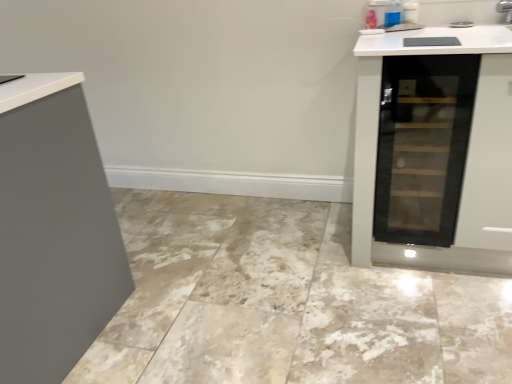
Question: Considering the relative sizes of transparent glass wine cooler at right and marble tile at center in the image provided, is transparent glass wine cooler at right thinner than marble tile at center?

Choices:
 (A) no
 (B) yes

Answer: (B)

Question: Is transparent glass wine cooler at right not inside marble tile at center?

Choices:
 (A) yes
 (B) no

Answer: (A)

Question: Can you confirm if transparent glass wine cooler at right is taller than marble tile at center?

Choices:
 (A) yes
 (B) no

Answer: (A)

Question: Is transparent glass wine cooler at right oriented towards marble tile at center?

Choices:
 (A) no
 (B) yes

Answer: (A)

Question: Is transparent glass wine cooler at right surrounding marble tile at center?

Choices:
 (A) yes
 (B) no

Answer: (B)

Question: Is transparent glass wine cooler at right to the right of marble tile at center from the viewer's perspective?

Choices:
 (A) no
 (B) yes

Answer: (B)

Question: Is marble tile at center wider than transparent glass wine cooler at right?

Choices:
 (A) yes
 (B) no

Answer: (A)

Question: Is marble tile at center thinner than transparent glass wine cooler at right?

Choices:
 (A) no
 (B) yes

Answer: (A)

Question: Is marble tile at center at the left side of transparent glass wine cooler at right?

Choices:
 (A) no
 (B) yes

Answer: (B)

Question: Does marble tile at center come in front of transparent glass wine cooler at right?

Choices:
 (A) no
 (B) yes

Answer: (B)

Question: Can you confirm if marble tile at center is bigger than transparent glass wine cooler at right?

Choices:
 (A) no
 (B) yes

Answer: (B)

Question: From the image's perspective, does marble tile at center appear lower than transparent glass wine cooler at right?

Choices:
 (A) yes
 (B) no

Answer: (A)

Question: Considering their positions, is marble tile at center located in front of or behind transparent glass wine cooler at right?

Choices:
 (A) front
 (B) behind

Answer: (A)